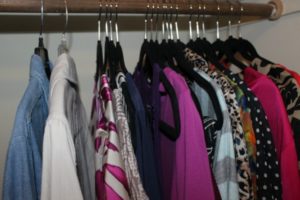
Identify the location of hung clothes. The image size is (300, 200). (183, 94), (49, 106), (228, 81).